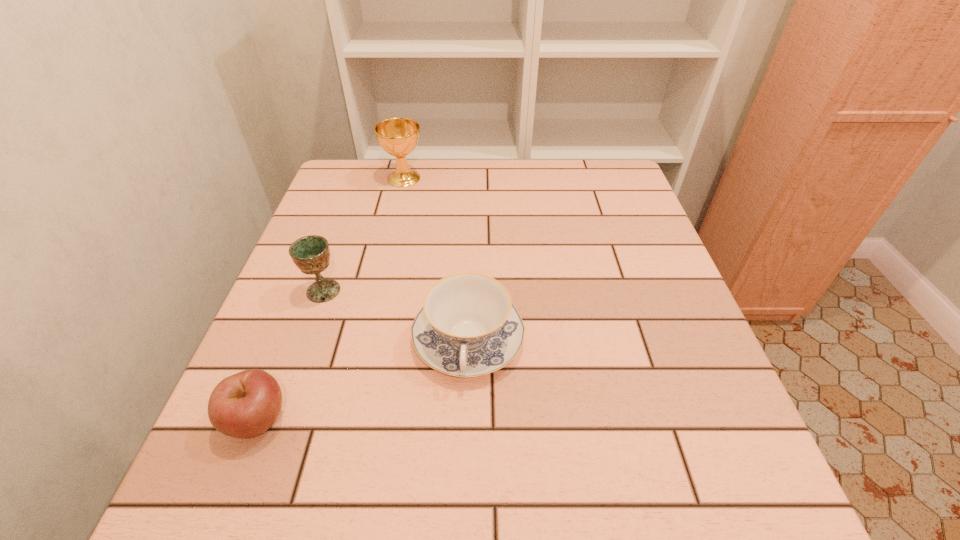
This screenshot has height=540, width=960. I want to click on the farthest object, so click(398, 137).

Where is `the tallest object`? the tallest object is located at coordinates (398, 137).

I want to click on the nearer chalice, so click(311, 254).

The image size is (960, 540). I want to click on the shorter chalice, so click(x=311, y=254).

In order to click on the rightmost object in this screenshot , I will do `click(468, 326)`.

Locate an element on the screen. The width and height of the screenshot is (960, 540). the nearest object is located at coordinates (244, 405).

You are a GUI agent. You are given a task and a screenshot of the screen. Output one action in this format:
    pyautogui.click(x=<x>, y=<y>)
    Task: Click on the apple
    The height and width of the screenshot is (540, 960).
    Given the screenshot: What is the action you would take?
    pyautogui.click(x=244, y=405)

At what (x,y) coordinates should I click in order to perform the action: click on free location located 0.260m on the right of the taller chalice. Please return your answer as a coordinate pair (x, y). Image resolution: width=960 pixels, height=540 pixels. Looking at the image, I should click on (516, 178).

Identify the location of vacant point located on the back of the nearer chalice. Image resolution: width=960 pixels, height=540 pixels. click(361, 184).

Locate an element on the screen. The image size is (960, 540). free space located with the handle on the side of the chinaware is located at coordinates (465, 472).